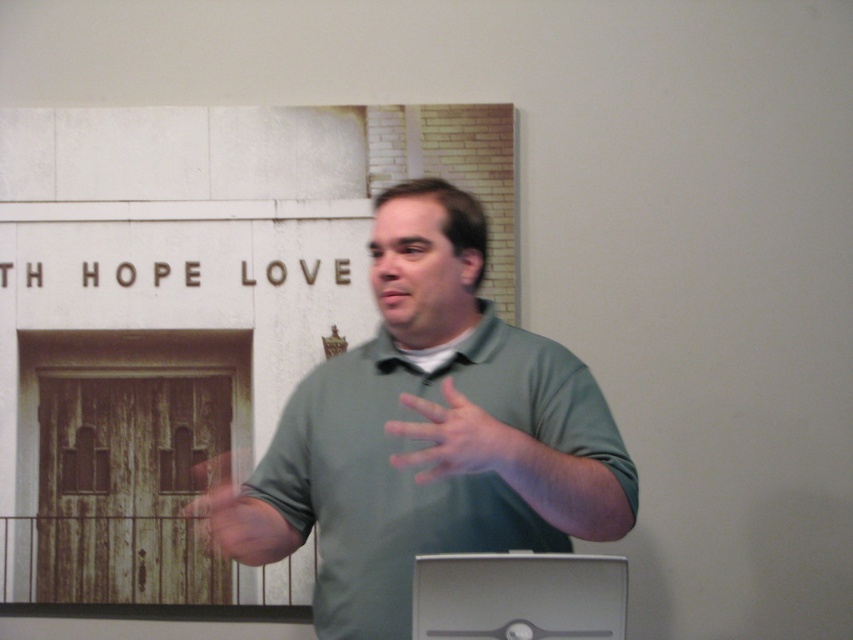
You are setting up a small table for a presentation. The table can only hold items that take up less space than the wooden door at center. Can the satin silver computer at lower center be placed on the table?

The satin silver computer at lower center occupies less space than the wooden door at center, so yes, it can be placed on the table since it meets the space requirement.